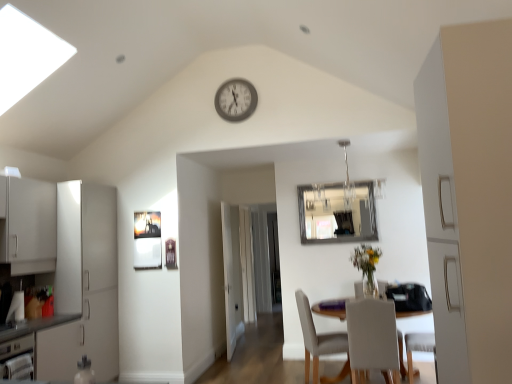
Question: Considering the positions of metallic silver dishwasher at lower left and white wooden door at center in the image, is metallic silver dishwasher at lower left wider or thinner than white wooden door at center?

Choices:
 (A) thin
 (B) wide

Answer: (A)

Question: Does point (14, 347) appear closer or farther from the camera than point (234, 208)?

Choices:
 (A) farther
 (B) closer

Answer: (B)

Question: Estimate the real-world distances between objects in this image. Which object is closer to the clear glass mirror at upper center?

Choices:
 (A) metallic gray clock at upper center
 (B) white wooden door at center
 (C) white matte cabinet at right
 (D) transparent glass door at center
 (E) white fabric chair at lower center, acting as the first chair starting from the front

Answer: (B)

Question: Which is farther from the white matte cabinet at right?

Choices:
 (A) white glossy cabinet at left
 (B) transparent glass door at center
 (C) white fabric chair at lower right, the first chair in the back-to-front sequence
 (D) white wooden door at center
 (E) clear glass mirror at upper center

Answer: (B)